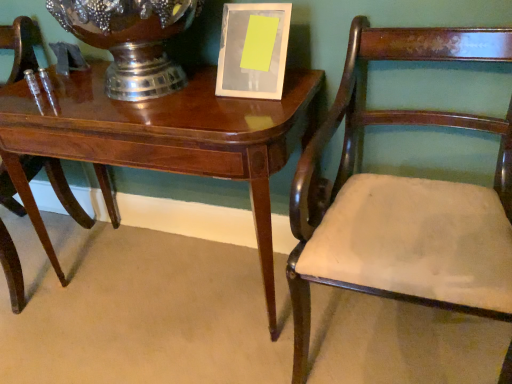
You are a GUI agent. You are given a task and a screenshot of the screen. Output one action in this format:
    pyautogui.click(x=<x>, y=<y>)
    Task: Click on the mahogany wood chair at left, the second chair positioned from the right
    
    Given the screenshot: What is the action you would take?
    pyautogui.click(x=56, y=185)

The image size is (512, 384). Identify the location of white glossy picture frame at upper center. (253, 50).

You are a GUI agent. You are given a task and a screenshot of the screen. Output one action in this format:
    pyautogui.click(x=<x>, y=<y>)
    Task: Click on the mahogany wood chair at right, positioned as the first chair in right-to-left order
    The height and width of the screenshot is (384, 512).
    Given the screenshot: What is the action you would take?
    click(403, 198)

Describe the element at coordinates (403, 198) in the screenshot. I see `mahogany wood chair at right, positioned as the first chair in right-to-left order` at that location.

The image size is (512, 384). In order to click on glossy wood table at center in this screenshot , I will do `click(161, 140)`.

Considering the points (267, 19) and (16, 188), which point is behind, point (267, 19) or point (16, 188)?

The point (16, 188) is more distant.

You are a GUI agent. You are given a task and a screenshot of the screen. Output one action in this format:
    pyautogui.click(x=<x>, y=<y>)
    Task: Click on the table directly beneath the white glossy picture frame at upper center (from a real-world perspective)
    This screenshot has height=384, width=512.
    Given the screenshot: What is the action you would take?
    pyautogui.click(x=161, y=140)

Does white glossy picture frame at upper center have a greater height compared to glossy wood table at center?

Incorrect, the height of white glossy picture frame at upper center is not larger of that of glossy wood table at center.

Based on the photo, from a real-world perspective, who is located lower, white glossy picture frame at upper center or glossy wood table at center?

In real-world perspective, glossy wood table at center is lower.

Could you tell me if mahogany wood chair at right, positioned as the first chair in right-to-left order, is turned towards brushed metal vase at upper center?

No, mahogany wood chair at right, positioned as the first chair in right-to-left order, does not turn towards brushed metal vase at upper center.

Which is behind, point (444, 290) or point (151, 24)?

Positioned behind is point (151, 24).

Find the location of a particular element. chair that is the 1st one below the brushed metal vase at upper center (from a real-world perspective) is located at coordinates (403, 198).

Does mahogany wood chair at right, the 2th chair viewed from the left, have a larger size compared to brushed metal vase at upper center?

Yes, mahogany wood chair at right, the 2th chair viewed from the left, is bigger than brushed metal vase at upper center.

Is brushed metal vase at upper center taller or shorter than mahogany wood chair at right, the 2th chair viewed from the left?

brushed metal vase at upper center is shorter than mahogany wood chair at right, the 2th chair viewed from the left.

From a real-world perspective, does brushed metal vase at upper center sit lower than mahogany wood chair at right, positioned as the first chair in right-to-left order?

Actually, brushed metal vase at upper center is physically above mahogany wood chair at right, positioned as the first chair in right-to-left order, in the real world.

Which of these two, brushed metal vase at upper center or mahogany wood chair at right, positioned as the first chair in right-to-left order, is bigger?

With larger size is mahogany wood chair at right, positioned as the first chair in right-to-left order.

From the image's perspective, between mahogany wood chair at left, the second chair positioned from the right, and brushed metal vase at upper center, which one is located above?

brushed metal vase at upper center is shown above in the image.

Is mahogany wood chair at left, the second chair positioned from the right, not near brushed metal vase at upper center?

No.

Could you tell me if mahogany wood chair at left, the second chair positioned from the right, is facing brushed metal vase at upper center?

No, mahogany wood chair at left, the second chair positioned from the right, is not turned towards brushed metal vase at upper center.

In terms of size, does mahogany wood chair at left, the second chair positioned from the right, appear bigger or smaller than brushed metal vase at upper center?

Considering their sizes, mahogany wood chair at left, the second chair positioned from the right, takes up more space than brushed metal vase at upper center.

Choose the correct answer: Is glossy wood table at center inside white glossy picture frame at upper center or outside it?

glossy wood table at center cannot be found inside white glossy picture frame at upper center.

Is glossy wood table at center taller or shorter than white glossy picture frame at upper center?

In the image, glossy wood table at center appears to be taller than white glossy picture frame at upper center.

Considering the sizes of objects glossy wood table at center and white glossy picture frame at upper center in the image provided, who is bigger, glossy wood table at center or white glossy picture frame at upper center?

With larger size is glossy wood table at center.

From a real-world perspective, is mahogany wood chair at left, the second chair positioned from the right, located higher than mahogany wood chair at right, positioned as the first chair in right-to-left order?

Incorrect, from a real-world perspective, mahogany wood chair at left, the second chair positioned from the right, is lower than mahogany wood chair at right, positioned as the first chair in right-to-left order.

Would you say mahogany wood chair at left, the first chair viewed from the left, is to the left or to the right of mahogany wood chair at right, the 2th chair viewed from the left, in the picture?

mahogany wood chair at left, the first chair viewed from the left, is positioned on mahogany wood chair at right, the 2th chair viewed from the left,'s left side.

Does mahogany wood chair at left, the first chair viewed from the left, have a lesser height compared to mahogany wood chair at right, positioned as the first chair in right-to-left order?

Indeed, mahogany wood chair at left, the first chair viewed from the left, has a lesser height compared to mahogany wood chair at right, positioned as the first chair in right-to-left order.

In terms of width, does mahogany wood chair at left, the second chair positioned from the right, look wider or thinner when compared to mahogany wood chair at right, positioned as the first chair in right-to-left order?

Clearly, mahogany wood chair at left, the second chair positioned from the right, has less width compared to mahogany wood chair at right, positioned as the first chair in right-to-left order.

From a real-world perspective, is white glossy picture frame at upper center physically above mahogany wood chair at right, the 2th chair viewed from the left?

Yes, from a real-world perspective, white glossy picture frame at upper center is above mahogany wood chair at right, the 2th chair viewed from the left.

Is mahogany wood chair at right, the 2th chair viewed from the left, located within white glossy picture frame at upper center?

No, white glossy picture frame at upper center does not contain mahogany wood chair at right, the 2th chair viewed from the left.

Considering the points (264, 59) and (392, 212), which point is in front, point (264, 59) or point (392, 212)?

The point (392, 212) is closer to the camera.

Which of these two, white glossy picture frame at upper center or mahogany wood chair at right, positioned as the first chair in right-to-left order, stands shorter?

white glossy picture frame at upper center.

In the image, there is a glossy wood table at center. Where is `picture frame above it (from the image's perspective)`? The height and width of the screenshot is (384, 512). picture frame above it (from the image's perspective) is located at coordinates (253, 50).

The image size is (512, 384). I want to click on chair lying on the right of brushed metal vase at upper center, so click(403, 198).

Based on their spatial positions, is mahogany wood chair at right, the 2th chair viewed from the left, or mahogany wood chair at left, the first chair viewed from the left, closer to brushed metal vase at upper center?

Among the two, mahogany wood chair at right, the 2th chair viewed from the left, is located nearer to brushed metal vase at upper center.

Based on the photo, which object lies further to the anchor point mahogany wood chair at right, positioned as the first chair in right-to-left order, glossy wood table at center or mahogany wood chair at left, the second chair positioned from the right?

mahogany wood chair at left, the second chair positioned from the right, is further to mahogany wood chair at right, positioned as the first chair in right-to-left order.

Which object lies nearer to the anchor point white glossy picture frame at upper center, brushed metal vase at upper center or glossy wood table at center?

Among the two, brushed metal vase at upper center is located nearer to white glossy picture frame at upper center.

Looking at the image, which one is located closer to mahogany wood chair at left, the second chair positioned from the right, white glossy picture frame at upper center or glossy wood table at center?

Among the two, glossy wood table at center is located nearer to mahogany wood chair at left, the second chair positioned from the right.

Based on their spatial positions, is mahogany wood chair at right, positioned as the first chair in right-to-left order, or glossy wood table at center further from white glossy picture frame at upper center?

mahogany wood chair at right, positioned as the first chair in right-to-left order, is positioned further to the anchor white glossy picture frame at upper center.

Considering their positions, is glossy wood table at center positioned further to brushed metal vase at upper center than mahogany wood chair at left, the second chair positioned from the right?

mahogany wood chair at left, the second chair positioned from the right, is further to brushed metal vase at upper center.

From the image, which object appears to be farther from mahogany wood chair at right, the 2th chair viewed from the left, mahogany wood chair at left, the second chair positioned from the right, or glossy wood table at center?

mahogany wood chair at left, the second chair positioned from the right.

Which object lies nearer to the anchor point mahogany wood chair at right, positioned as the first chair in right-to-left order, brushed metal vase at upper center or white glossy picture frame at upper center?

white glossy picture frame at upper center is positioned closer to the anchor mahogany wood chair at right, positioned as the first chair in right-to-left order.

You are a GUI agent. You are given a task and a screenshot of the screen. Output one action in this format:
    pyautogui.click(x=<x>, y=<y>)
    Task: Click on the picture frame that lies between brushed metal vase at upper center and glossy wood table at center from top to bottom
    This screenshot has width=512, height=384.
    Given the screenshot: What is the action you would take?
    pyautogui.click(x=253, y=50)

Find the location of a particular element. table between brushed metal vase at upper center and mahogany wood chair at right, positioned as the first chair in right-to-left order is located at coordinates (x=161, y=140).

Locate an element on the screen. The height and width of the screenshot is (384, 512). table situated between mahogany wood chair at left, the first chair viewed from the left, and mahogany wood chair at right, the 2th chair viewed from the left, from left to right is located at coordinates (161, 140).

Where is `glass vase situated between mahogany wood chair at left, the first chair viewed from the left, and mahogany wood chair at right, positioned as the first chair in right-to-left order, from left to right`? This screenshot has height=384, width=512. glass vase situated between mahogany wood chair at left, the first chair viewed from the left, and mahogany wood chair at right, positioned as the first chair in right-to-left order, from left to right is located at coordinates (131, 40).